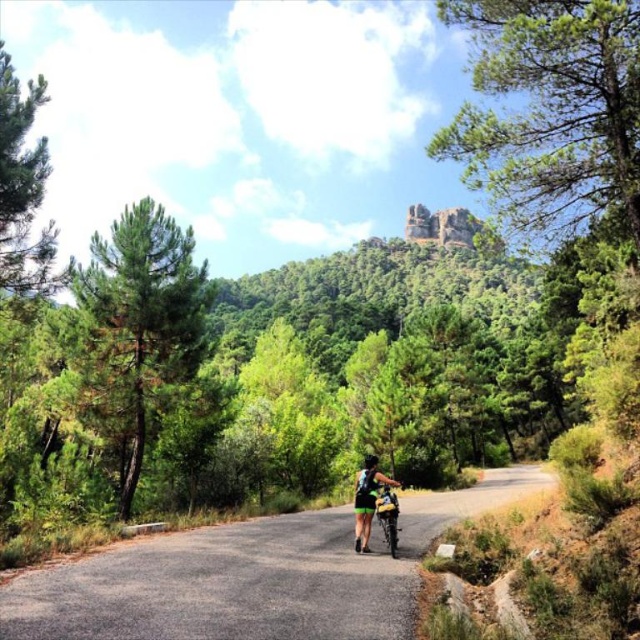
Question: Estimate the real-world distances between objects in this image. Which object is closer to the metallic silver bicycle at center?

Choices:
 (A) green matte shorts at center
 (B) gray asphalt road at center

Answer: (A)

Question: Estimate the real-world distances between objects in this image. Which object is farther from the gray asphalt road at center?

Choices:
 (A) green matte shorts at center
 (B) metallic silver bicycle at center

Answer: (B)

Question: Can you confirm if green matte shorts at center is positioned below metallic silver bicycle at center?

Choices:
 (A) no
 (B) yes

Answer: (B)

Question: Which of the following is the farthest from the observer?

Choices:
 (A) metallic silver bicycle at center
 (B) green matte shorts at center

Answer: (B)

Question: Is green matte shorts at center to the right of metallic silver bicycle at center from the viewer's perspective?

Choices:
 (A) no
 (B) yes

Answer: (B)

Question: Does gray asphalt road at center appear on the right side of green matte shorts at center?

Choices:
 (A) yes
 (B) no

Answer: (B)